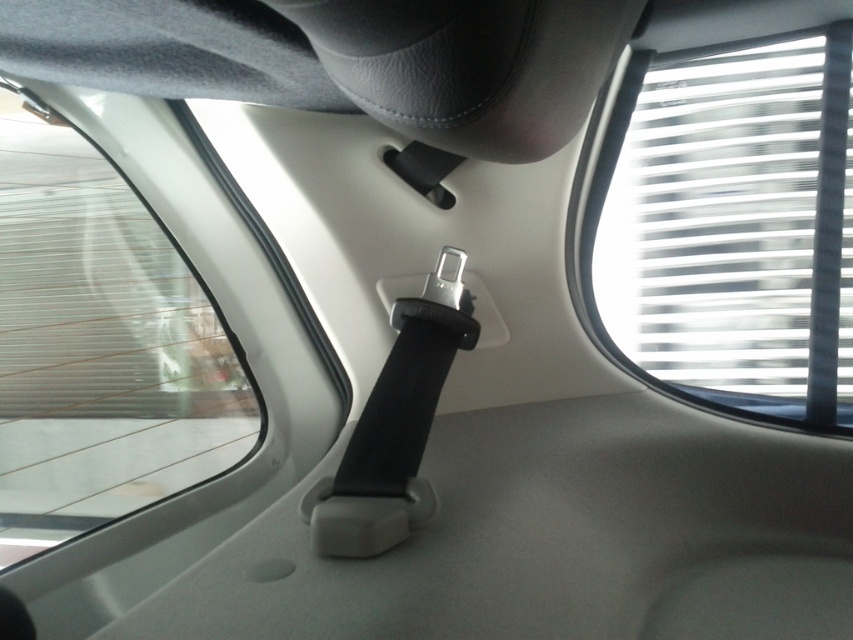
Question: Which point is closer to the camera taking this photo?

Choices:
 (A) (633, 154)
 (B) (151, 348)

Answer: (A)

Question: Is white translucent blinds at upper right bigger than transparent glass window at center?

Choices:
 (A) no
 (B) yes

Answer: (A)

Question: Is white translucent blinds at upper right below transparent glass window at center?

Choices:
 (A) no
 (B) yes

Answer: (A)

Question: Which of the following is the closest to the observer?

Choices:
 (A) white translucent blinds at upper right
 (B) transparent glass window at center

Answer: (A)

Question: Is white translucent blinds at upper right wider than transparent glass window at center?

Choices:
 (A) yes
 (B) no

Answer: (B)